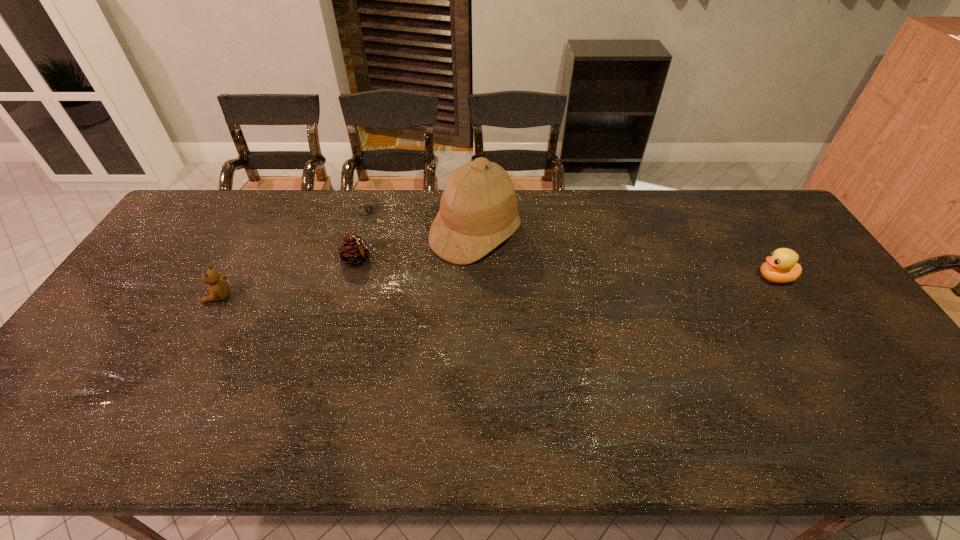
Where is `vacant spot on the desktop that is between the teddy bear and the rightmost object and is positioned with a leaf charm attached to the pinecone`? The image size is (960, 540). vacant spot on the desktop that is between the teddy bear and the rightmost object and is positioned with a leaf charm attached to the pinecone is located at coordinates (421, 290).

This screenshot has width=960, height=540. Find the location of `vacant space on the desktop that is between the teddy bear and the duckling and is positioned on the face of the watch`. vacant space on the desktop that is between the teddy bear and the duckling and is positioned on the face of the watch is located at coordinates (436, 289).

What are the coordinates of `vacant space on the desktop that is between the teddy bear and the duckling and is positioned on the front-facing side of the hat` in the screenshot? It's located at (568, 285).